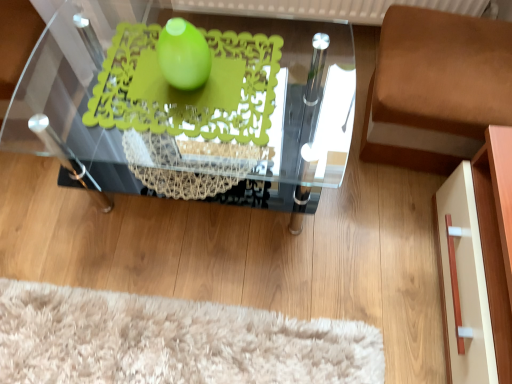
Question: From a real-world perspective, does transparent glass table at center sit lower than brown fabric cushion at right?

Choices:
 (A) no
 (B) yes

Answer: (A)

Question: Is transparent glass table at center thinner than brown fabric cushion at right?

Choices:
 (A) yes
 (B) no

Answer: (B)

Question: Is transparent glass table at center not within brown fabric cushion at right?

Choices:
 (A) no
 (B) yes

Answer: (B)

Question: Is transparent glass table at center surrounding brown fabric cushion at right?

Choices:
 (A) no
 (B) yes

Answer: (A)

Question: Is transparent glass table at center at the left side of brown fabric cushion at right?

Choices:
 (A) yes
 (B) no

Answer: (A)

Question: Is transparent glass table at center not near brown fabric cushion at right?

Choices:
 (A) no
 (B) yes

Answer: (A)

Question: Can you confirm if green matte doily at center is shorter than brown fabric cushion at right?

Choices:
 (A) no
 (B) yes

Answer: (B)

Question: Is green matte doily at center at the right side of brown fabric cushion at right?

Choices:
 (A) yes
 (B) no

Answer: (B)

Question: From the image's perspective, does green matte doily at center appear lower than brown fabric cushion at right?

Choices:
 (A) no
 (B) yes

Answer: (B)

Question: Does green matte doily at center come behind brown fabric cushion at right?

Choices:
 (A) yes
 (B) no

Answer: (B)

Question: Is green matte doily at center positioned far away from brown fabric cushion at right?

Choices:
 (A) no
 (B) yes

Answer: (A)

Question: Does green matte doily at center have a smaller size compared to brown fabric cushion at right?

Choices:
 (A) yes
 (B) no

Answer: (A)

Question: Is green matte doily at center positioned before green matte sphere at center?

Choices:
 (A) yes
 (B) no

Answer: (B)